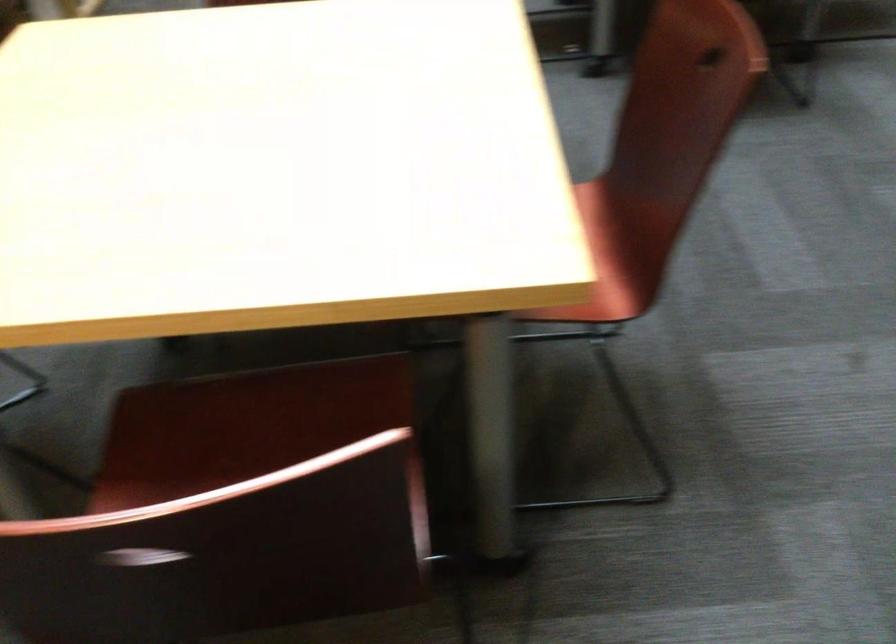
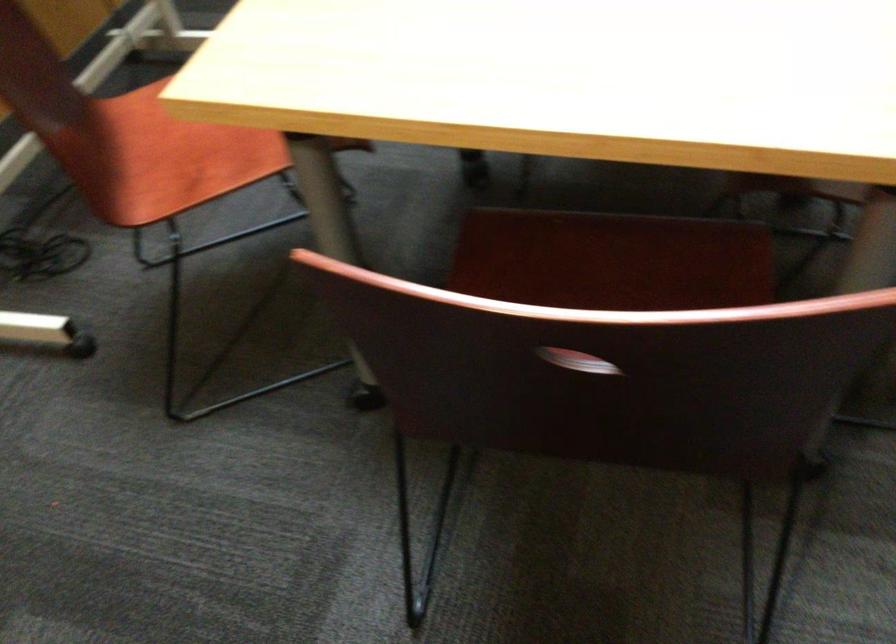
Find the pixel in the second image that matches point (165, 553) in the first image.

(576, 361)